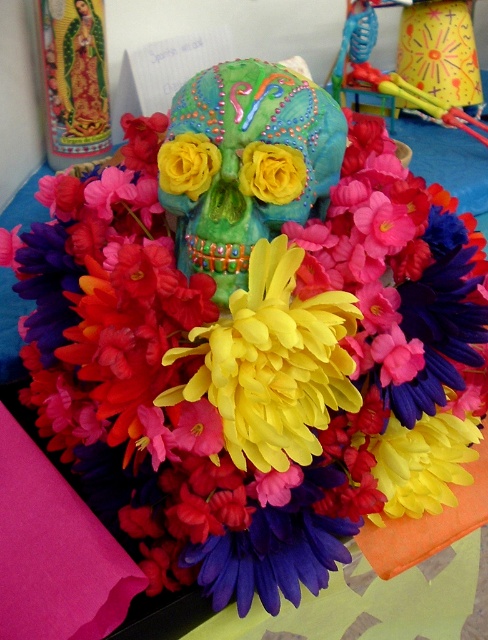
Question: Is yellow paper flower at center bigger than metallic blue toy at upper right?

Choices:
 (A) yes
 (B) no

Answer: (B)

Question: Considering the real-world distances, which object is farthest from the yellow paper flower at center?

Choices:
 (A) matte painted skull at center
 (B) metallic blue toy at upper right

Answer: (B)

Question: Can you confirm if matte painted skull at center is wider than metallic blue toy at upper right?

Choices:
 (A) no
 (B) yes

Answer: (A)

Question: Which object appears farthest from the camera in this image?

Choices:
 (A) matte painted skull at center
 (B) metallic blue toy at upper right

Answer: (B)

Question: Which of the following is the farthest from the observer?

Choices:
 (A) metallic blue toy at upper right
 (B) yellow paper flower at center

Answer: (A)

Question: Observing the image, what is the correct spatial positioning of matte painted skull at center in reference to yellow paper flower at center?

Choices:
 (A) left
 (B) right

Answer: (A)